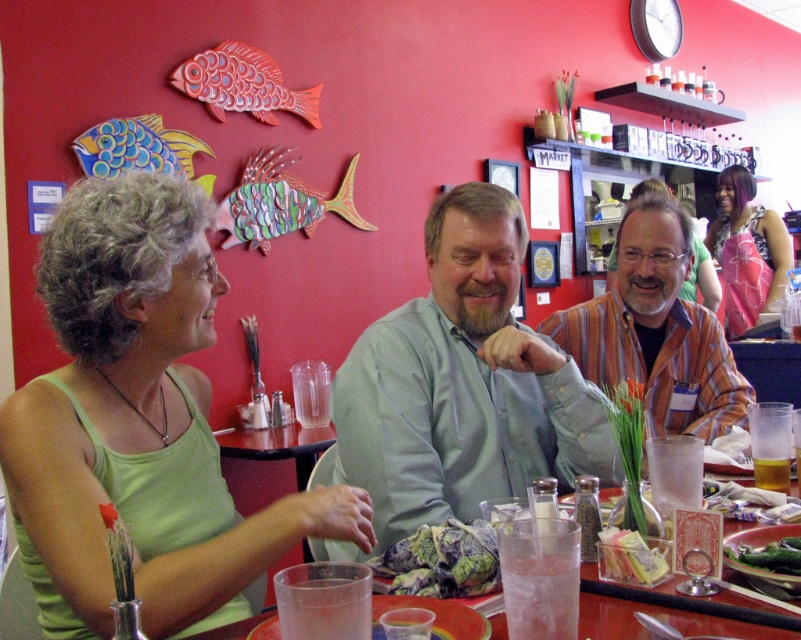
Is green matte shirt at center taller than translucent glass cup at table center?

Indeed, green matte shirt at center has a greater height compared to translucent glass cup at table center.

Based on the photo, is green matte shirt at center thinner than translucent glass cup at table center?

No.

Is point (367, 428) farther from viewer compared to point (779, 480)?

No, it is in front of (779, 480).

Identify the location of green matte shirt at center. Image resolution: width=801 pixels, height=640 pixels. (461, 384).

Describe the element at coordinates (461, 384) in the screenshot. I see `green matte shirt at center` at that location.

Which of these two, green matte shirt at center or pink satin dress at upper right, stands shorter?

green matte shirt at center is shorter.

Where is `green matte shirt at center`? green matte shirt at center is located at coordinates (461, 384).

Can you confirm if pink satin dress at upper right is thinner than clear plastic cup at center?

Incorrect, pink satin dress at upper right's width is not less than clear plastic cup at center's.

In the scene shown: Does pink satin dress at upper right have a greater width compared to clear plastic cup at center?

Yes.

Which is behind, point (717, 188) or point (558, 577)?

The point (717, 188) is behind.

Find the location of `pink satin dress at upper right`. pink satin dress at upper right is located at coordinates (747, 250).